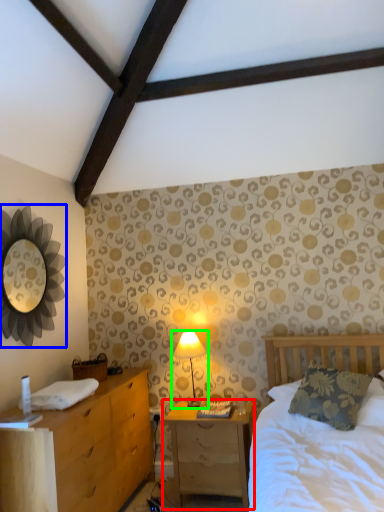
Question: Which object is the closest to the nightstand (highlighted by a red box)? Choose among these: mirror (highlighted by a blue box) or table lamp (highlighted by a green box).

Choices:
 (A) mirror
 (B) table lamp

Answer: (B)